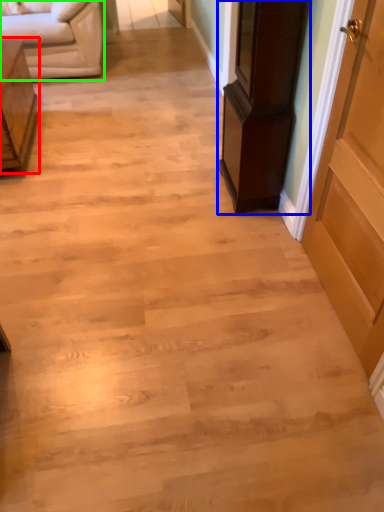
Question: Based on their relative distances, which object is nearer to furniture (highlighted by a red box)? Choose from furniture (highlighted by a blue box) and studio couch (highlighted by a green box).

Choices:
 (A) furniture
 (B) studio couch

Answer: (B)